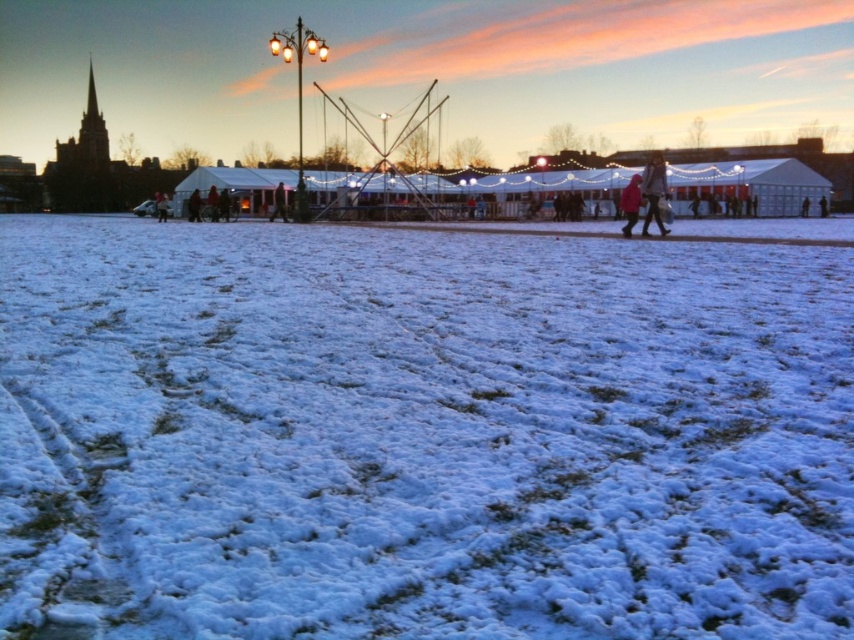
You are standing at the center of the winter scene and see the point marked as point (654, 193). What object is located at this point?

The point (654, 193) corresponds to the location of the matte pink coat at right.

You are an event organizer planning to place a new booth in the winter scene. The booth requires a space wider than the matte pink coat at center. Can the white fluffy snow at center accommodate the booth?

The white fluffy snow at center is wider than the matte pink coat at center, so it can accommodate the booth as it provides sufficient width.

You are planning to take a photo of the white fluffy snow at center and the matte pink coat at right. Which object should you focus on first if you want to capture both in a single shot without moving the camera?

You should focus on the matte pink coat at right first because it is larger and will require more attention to detail, while the smaller white fluffy snow at center can be framed around it.